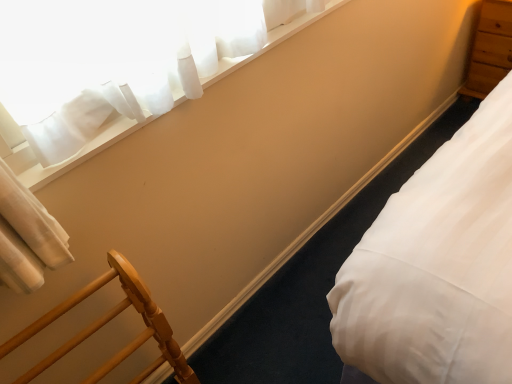
Question: Is light brown wood dresser at upper right in front of or behind wooden chair at lower left in the image?

Choices:
 (A) behind
 (B) front

Answer: (A)

Question: Based on their positions, is light brown wood dresser at upper right located to the left or right of wooden chair at lower left?

Choices:
 (A) left
 (B) right

Answer: (B)

Question: Which object is positioned farthest from the white sheer curtain at upper left?

Choices:
 (A) wooden chair at lower left
 (B) light brown wood dresser at upper right
 (C) white smooth bed at lower right

Answer: (B)

Question: Based on their relative distances, which object is nearer to the light brown wood dresser at upper right?

Choices:
 (A) white smooth bed at lower right
 (B) white sheer curtain at upper left
 (C) wooden chair at lower left

Answer: (A)